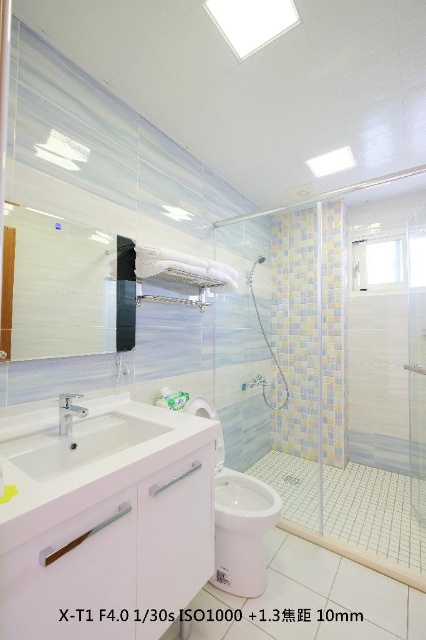
You are designing a bathroom layout and need to place a new decorative item. The white glossy sink at lower left and the white glossy tile at center are already present. Which object should you place the item next to if you want it to be more noticeable due to size?

You should place the item next to the white glossy sink at lower left because it is larger in size than the white glossy tile at center, making it more noticeable.

You are standing in the bathroom and want to take a shower. Where should you go relative to the transparent glass shower door at right?

The transparent glass shower door at right is located at point (337,368), so you should go to the right side of the bathroom to reach it.